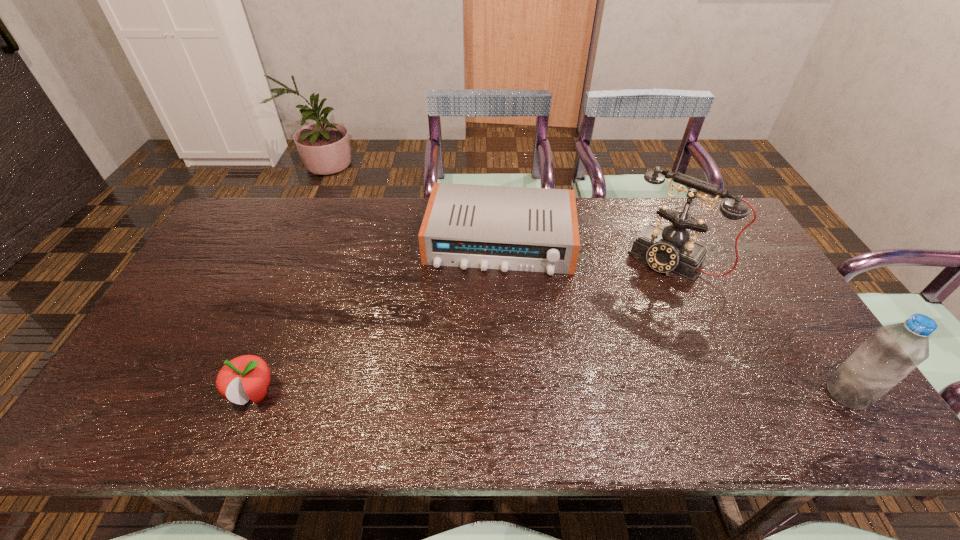
Locate an element on the screen. vacant space that's between the water bottle and the radio receiver is located at coordinates (674, 318).

The image size is (960, 540). I want to click on unoccupied position between the water bottle and the leftmost object, so click(x=551, y=394).

Find the location of a particular element. This screenshot has width=960, height=540. vacant area between the leftmost object and the telephone is located at coordinates (463, 326).

Locate an element on the screen. empty space that is in between the rightmost object and the leftmost object is located at coordinates (551, 394).

Image resolution: width=960 pixels, height=540 pixels. Identify the location of free space between the rightmost object and the second object from left to right. (674, 318).

Identify the location of object that is the second nearest to the telephone. This screenshot has width=960, height=540. (893, 351).

Select which object appears as the closest to the second object from right to left. Please provide its 2D coordinates. Your answer should be formatted as a tuple, i.e. [(x, y)], where the tuple contains the x and y coordinates of a point satisfying the conditions above.

[(477, 226)]

The width and height of the screenshot is (960, 540). I want to click on free space that satisfies the following two spatial constraints: 1. on the front side of the water bottle; 2. on the left side of the second object from right to left, so click(x=732, y=393).

Find the location of `blank space that satisfies the following two spatial constraints: 1. on the front side of the rightmost object; 2. on the left side of the radio receiver`. blank space that satisfies the following two spatial constraints: 1. on the front side of the rightmost object; 2. on the left side of the radio receiver is located at coordinates 508,393.

Find the location of a particular element. The width and height of the screenshot is (960, 540). vacant space that satisfies the following two spatial constraints: 1. on the front side of the shortest object; 2. on the left side of the rightmost object is located at coordinates (508, 393).